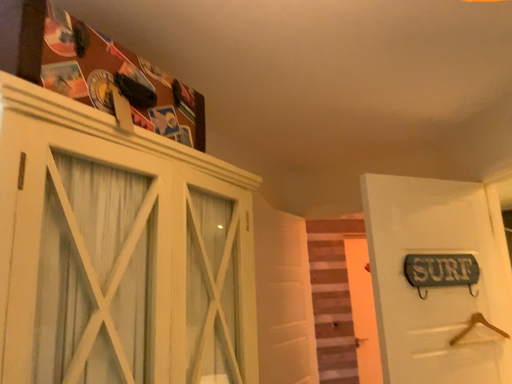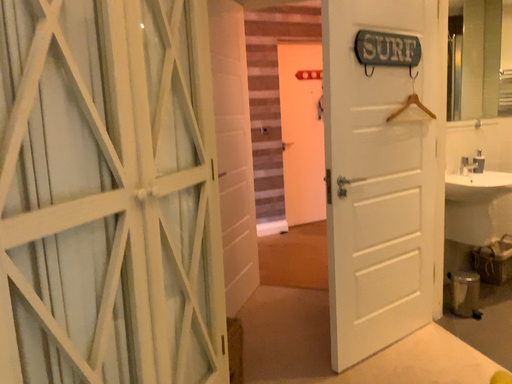
Question: Which way did the camera rotate in the video?

Choices:
 (A) rotated left
 (B) rotated right

Answer: (B)